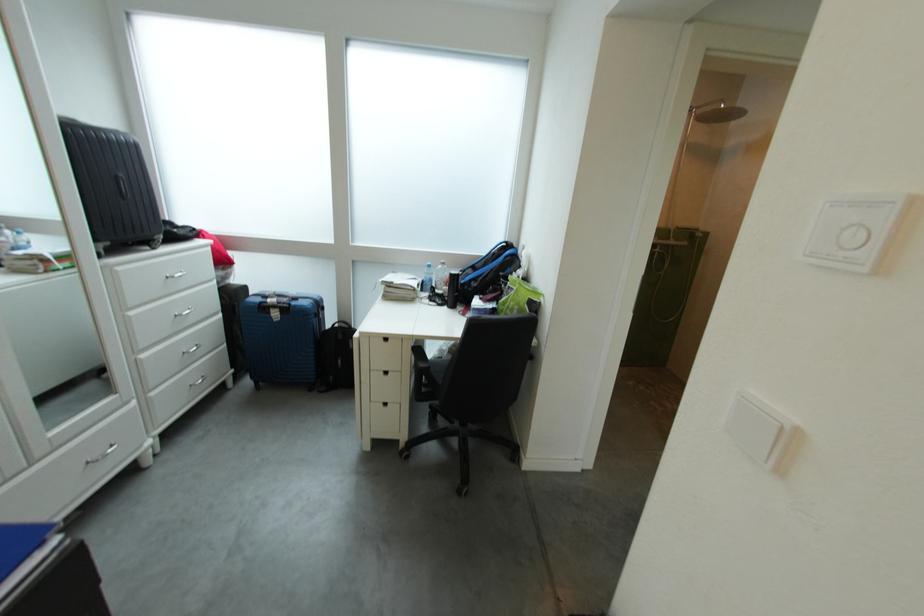
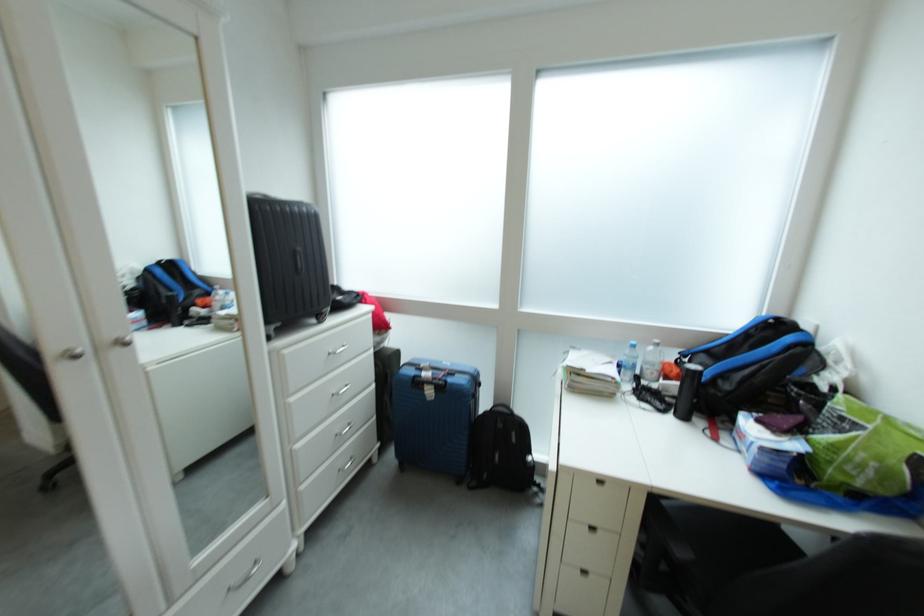
In the second image, find the point that corresponds to the point at 445,288 in the first image.

(650, 376)